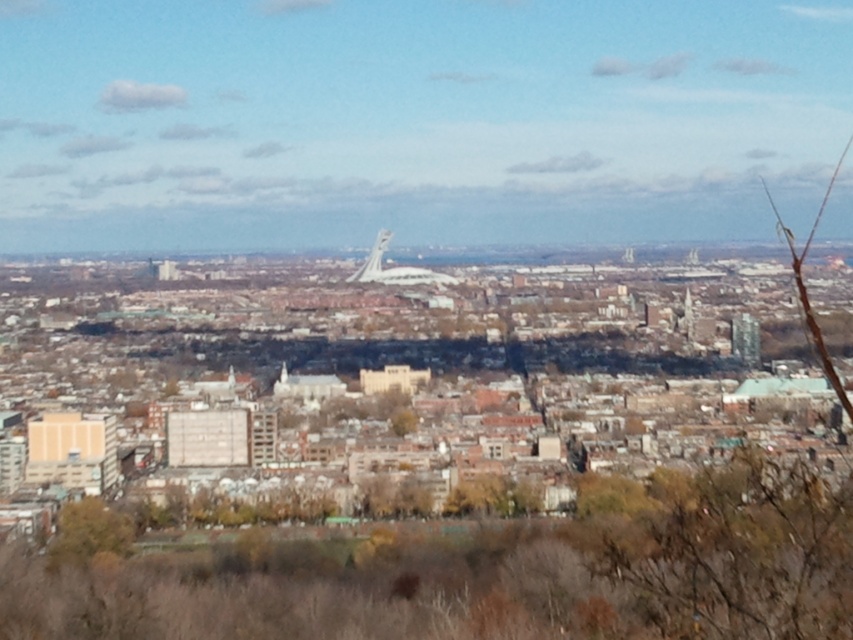
You are standing in the city park and see the brown leafy tree at center and the green leafy tree at lower left. Which tree is closer to the ground?

The brown leafy tree at center is located below the green leafy tree at lower left, so it is closer to the ground.

You are a city planner analyzing the urban green spaces. You observe the brown leafy tree at center and the green leafy tree at lower left in the cityscape. Which tree would require more space for maintenance equipment to maneuver around it?

The brown leafy tree at center requires more space for maintenance equipment to maneuver around it because it is larger in size than the green leafy tree at lower left.

You are a drone operator trying to fly a drone from the brown leafy tree at center to the white dome building with spire in the middle ground. The drone has a maximum flight range of 2000 feet. Based on the scene, will the drone be able to reach the destination?

The distance between the brown leafy tree at center and the white dome building with spire in the middle ground is 2062.83 feet, which exceeds the drone maximum flight range of 2000 feet. Therefore, the drone will not be able to reach the destination.